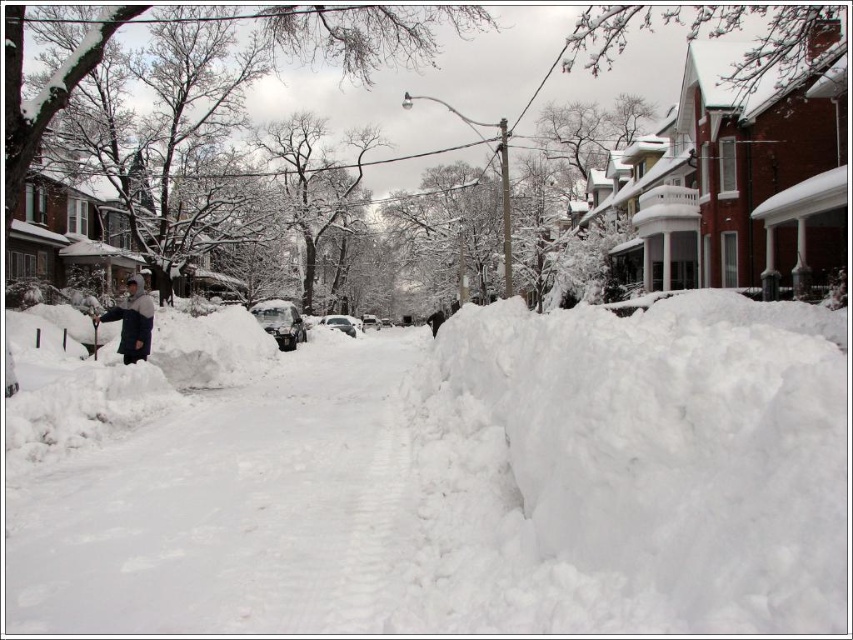
You are standing at the origin point of the coordinate system in the image. Which direction should you move to reach the white snow pavement at center?

The white snow pavement at center is located at coordinate point 0.795 on the x axis and 0.268 on the y axis. Since you are at the origin, you should move towards the positive x and positive y direction to reach it.